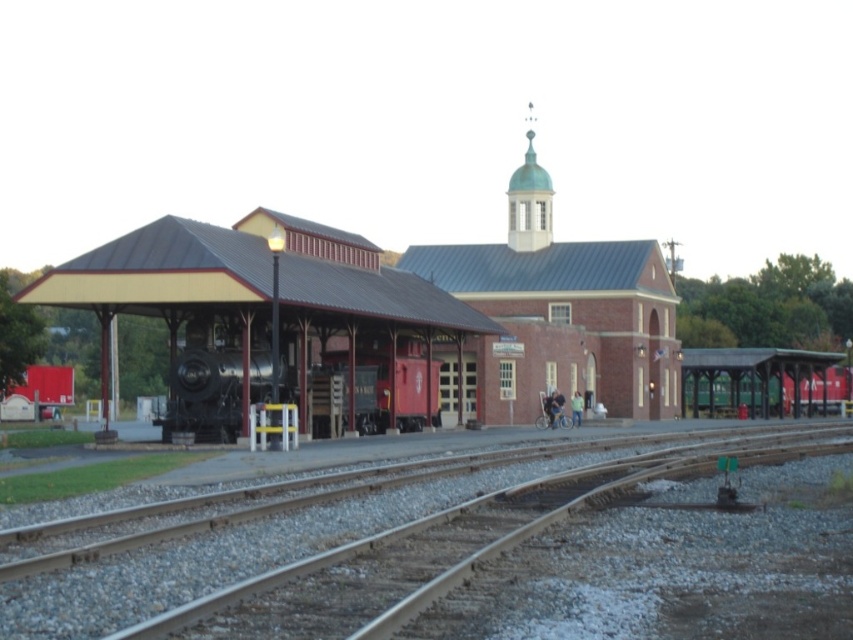
Does smooth steel tracks at center lie in front of polished steel train at center?

Yes, it is in front of polished steel train at center.

Which is in front, point (442, 496) or point (422, 394)?

Point (442, 496)

Is point (221, 576) positioned after point (230, 428)?

No, (221, 576) is closer to viewer.

The image size is (853, 640). I want to click on smooth steel tracks at center, so click(x=349, y=556).